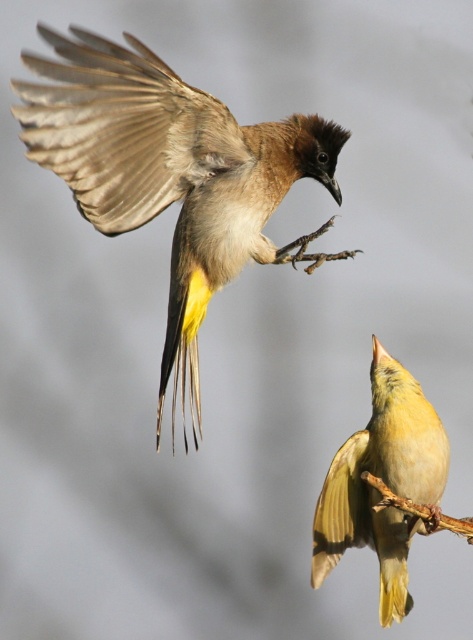
You are standing in front of the image and want to determine which of the two points, point (218, 253) or point (427, 440), is closer to you. Based on the scene description, which point is nearer?

Point (218, 253) is further to the viewer than point (427, 440), so point (218, 253) is nearer to you.

Where is the brown feathered bird at upper left located in the image?

The brown feathered bird at upper left is located at point coordinates of (172, 173).